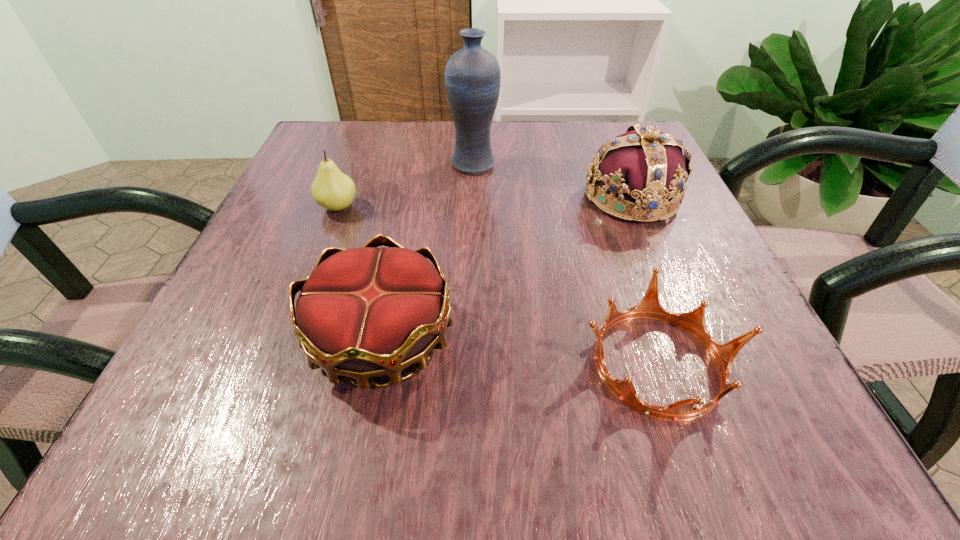
At what (x,y) coordinates should I click in order to perform the action: click on vacant space at the left edge of the desktop. Please return your answer as a coordinate pair (x, y). Looking at the image, I should click on (256, 267).

Image resolution: width=960 pixels, height=540 pixels. In order to click on vacant position at the right edge of the desktop in this screenshot , I will do `click(658, 345)`.

Image resolution: width=960 pixels, height=540 pixels. I want to click on vacant area at the far left corner, so click(313, 152).

At what (x,y) coordinates should I click in order to perform the action: click on free spot between the leftmost crown and the farthest crown. Please return your answer as a coordinate pair (x, y). Looking at the image, I should click on (507, 268).

The image size is (960, 540). Find the location of `vacant area that lies between the pear and the farthest crown`. vacant area that lies between the pear and the farthest crown is located at coordinates (485, 202).

At what (x,y) coordinates should I click in order to perform the action: click on vacant area that lies between the second tallest object and the pear. Please return your answer as a coordinate pair (x, y). Image resolution: width=960 pixels, height=540 pixels. Looking at the image, I should click on (485, 202).

I want to click on vacant area between the shortest crown and the second tallest crown, so click(x=519, y=351).

Locate an element on the screen. vacant area that lies between the vase and the shortest object is located at coordinates [565, 264].

Identify the location of free space between the pear and the shortest crown. The height and width of the screenshot is (540, 960). (498, 286).

Locate an element on the screen. The width and height of the screenshot is (960, 540). free space between the tallest crown and the leftmost crown is located at coordinates (507, 268).